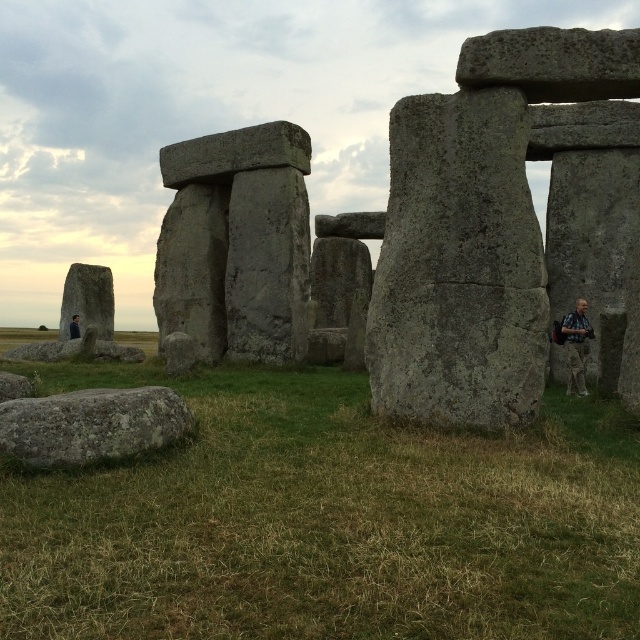
Is green grass at center closer to camera compared to gray rough boulder at lower left?

Yes, green grass at center is in front of gray rough boulder at lower left.

Does point (608, 593) lie in front of point (13, 444)?

That is True.

Where is `green grass at center`? green grass at center is located at coordinates (324, 518).

Can you confirm if gray stone structure at center is bigger than gray rough boulder at lower left?

Yes, gray stone structure at center is bigger than gray rough boulder at lower left.

Can you confirm if gray stone structure at center is taller than gray rough boulder at lower left?

Correct, gray stone structure at center is much taller as gray rough boulder at lower left.

The image size is (640, 640). Identify the location of gray stone structure at center. (476, 228).

Is gray stone structure at center wider than dark blue shirt at lower left?

Yes, gray stone structure at center is wider than dark blue shirt at lower left.

The width and height of the screenshot is (640, 640). What do you see at coordinates (476, 228) in the screenshot? I see `gray stone structure at center` at bounding box center [476, 228].

Who is more forward, (424, 353) or (70, 328)?

Point (424, 353) is in front.

Identify the location of gray stone structure at center. (476, 228).